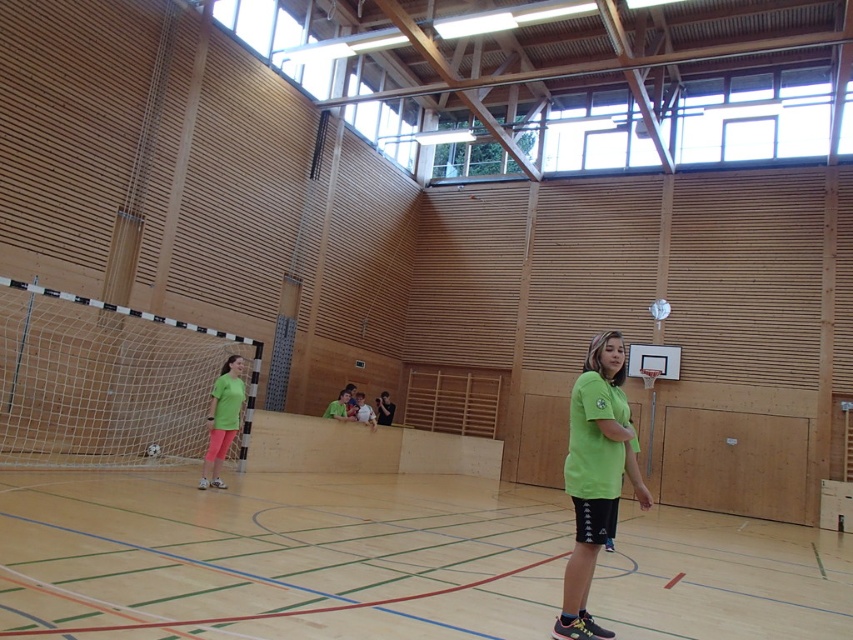
Which is more to the left, wooden basketball court at center or green matte shirt at center?

Positioned to the left is wooden basketball court at center.

Image resolution: width=853 pixels, height=640 pixels. Describe the element at coordinates (280, 556) in the screenshot. I see `wooden basketball court at center` at that location.

From the picture: Who is more forward, (611,592) or (585,566)?

Point (585,566) is in front.

Locate an element on the screen. The height and width of the screenshot is (640, 853). wooden basketball court at center is located at coordinates (280, 556).

Is point (607, 417) more distant than point (230, 416)?

No, (607, 417) is in front of (230, 416).

You are a GUI agent. You are given a task and a screenshot of the screen. Output one action in this format:
    pyautogui.click(x=<x>, y=<y>)
    Task: Click on the green matte shirt at center
    
    Given the screenshot: What is the action you would take?
    pyautogui.click(x=595, y=476)

Which is below, wooden basketball court at center or green matte shirt at lower left?

Positioned lower is wooden basketball court at center.

Is wooden basketball court at center bigger than green matte shirt at lower left?

Yes, wooden basketball court at center is bigger than green matte shirt at lower left.

This screenshot has width=853, height=640. I want to click on wooden basketball court at center, so click(280, 556).

Locate an element on the screen. This screenshot has height=640, width=853. wooden basketball court at center is located at coordinates (280, 556).